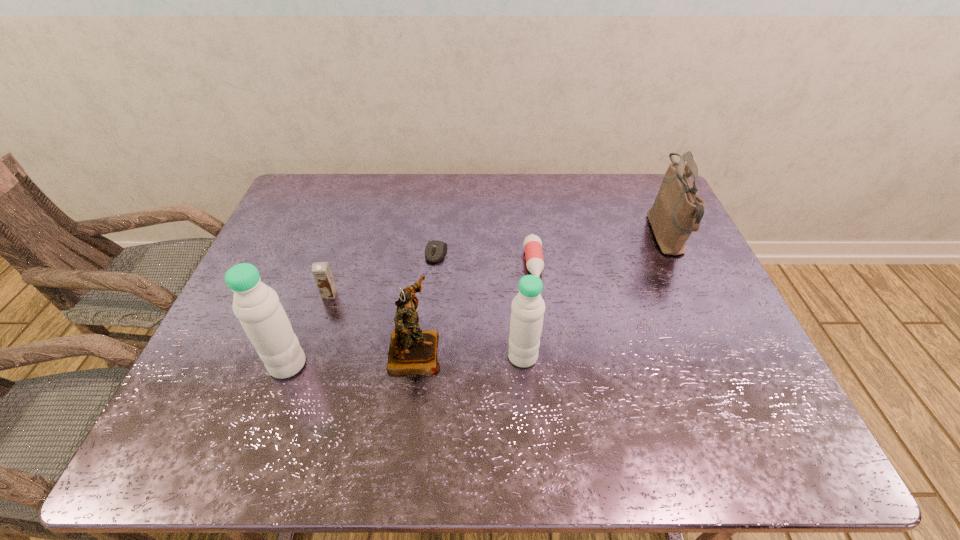
I want to click on object situated at the left edge, so click(x=256, y=305).

I want to click on object situated at the right edge, so click(x=677, y=211).

Locate an element on the screen. object that is positioned at the near left corner is located at coordinates (256, 305).

Identify the location of object that is at the far right corner. pos(677,211).

Identify the location of free space at the far edge of the desktop. This screenshot has height=540, width=960. (576, 181).

At what (x,y) coordinates should I click in order to perform the action: click on vacant area at the near edge. Please return your answer as a coordinate pair (x, y). Image resolution: width=960 pixels, height=540 pixels. Looking at the image, I should click on (557, 377).

Image resolution: width=960 pixels, height=540 pixels. I want to click on vacant area at the right edge of the desktop, so click(x=687, y=354).

Identify the location of vacant point at the far left corner. This screenshot has height=540, width=960. (345, 180).

This screenshot has height=540, width=960. I want to click on vacant area at the far right corner of the desktop, so click(x=626, y=184).

Locate an element on the screen. Image resolution: width=960 pixels, height=540 pixels. vacant space at the near right corner is located at coordinates (713, 398).